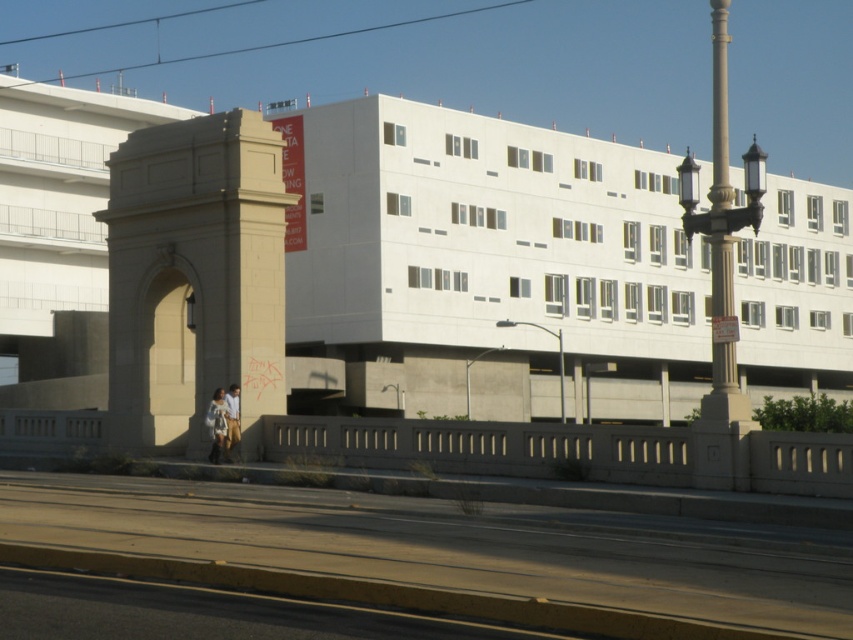
You are standing at the center of the road with tram tracks. You want to walk to the beige stone arch at left. In which direction should you walk?

You should walk to the left towards the beige stone arch at left.

You are standing in the urban scene and want to determine which of the two points, point (221, 433) or point (236, 429), is nearer to you. Based on the scene description, which point is closer?

Point (221, 433) is closer to the camera than point (236, 429), so it is the nearer one.